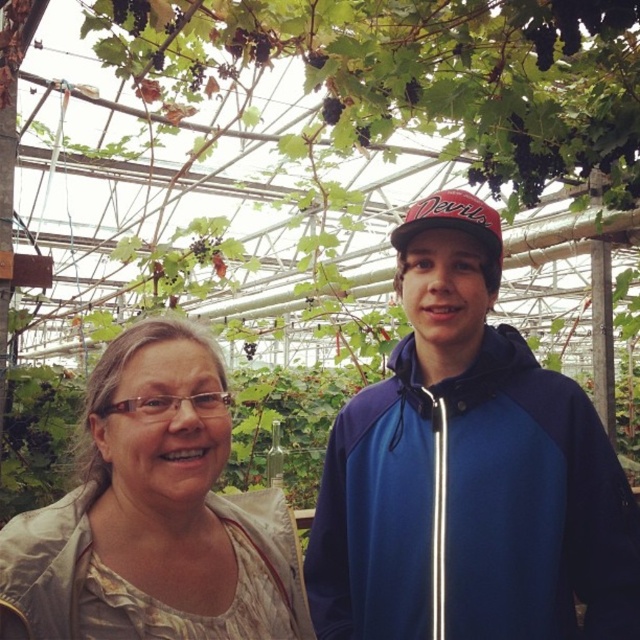
Question: Can you confirm if blue fleece jacket at center is positioned to the right of light beige fabric at center?

Choices:
 (A) no
 (B) yes

Answer: (B)

Question: Which point is farther to the camera?

Choices:
 (A) light beige fabric at center
 (B) red fabric baseball cap at center

Answer: (B)

Question: Among these points, which one is farthest from the camera?

Choices:
 (A) (148, 508)
 (B) (490, 376)
 (C) (464, 220)

Answer: (B)

Question: Considering the real-world distances, which object is closest to the red fabric baseball cap at center?

Choices:
 (A) light beige fabric at center
 (B) blue fleece jacket at center

Answer: (B)

Question: Is light beige fabric at center thinner than red fabric baseball cap at center?

Choices:
 (A) no
 (B) yes

Answer: (A)

Question: Where is blue fleece jacket at center located in relation to red fabric baseball cap at center in the image?

Choices:
 (A) right
 (B) left

Answer: (A)